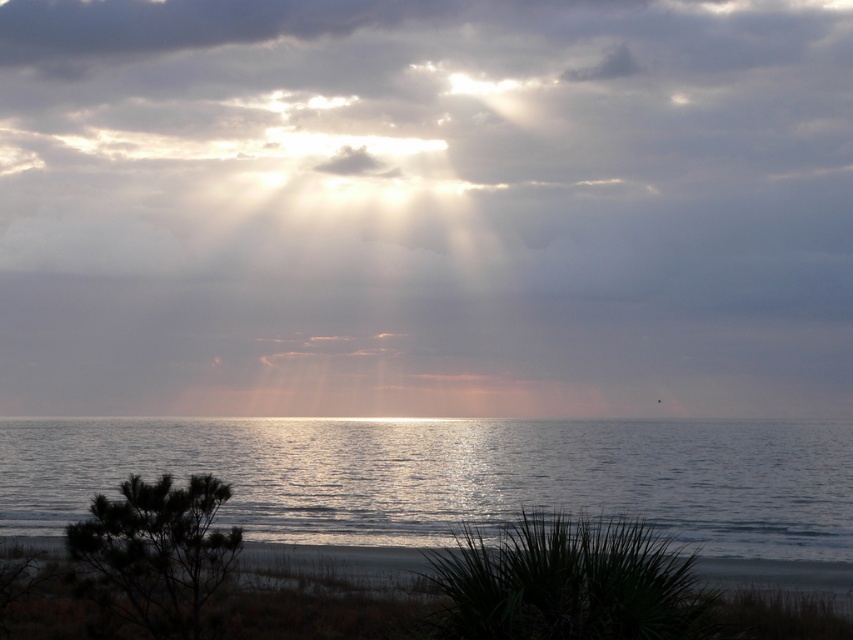
Looking at this image, you are standing at the center of the image and want to locate the glistening water at lower center. According to the coordinates provided, in which direction should you look to find it?

The glistening water at lower center is located at point 0.744 on the x axis and 0.533 on the y axis. Since the coordinates are based on the image frame, you should look to the right side of the image to find the glistening water at lower center.

You are standing at the camera position and want to reach the point marked at coordinates (318, 44) in the scene. Given that your walking speed is 3 feet per second, how many seconds will it take you to reach that point?

The point marked at coordinates (318, 44) is 702.59 feet away from the camera. At a walking speed of 3 feet per second, it would take approximately 234.2 seconds to reach that point.